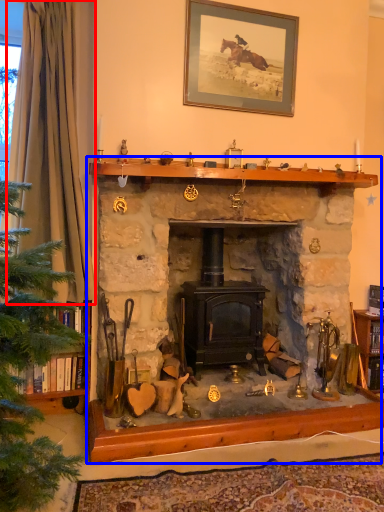
Question: Which of the following is the closest to the observer, curtain (highlighted by a red box) or fireplace (highlighted by a blue box)?

Choices:
 (A) curtain
 (B) fireplace

Answer: (B)